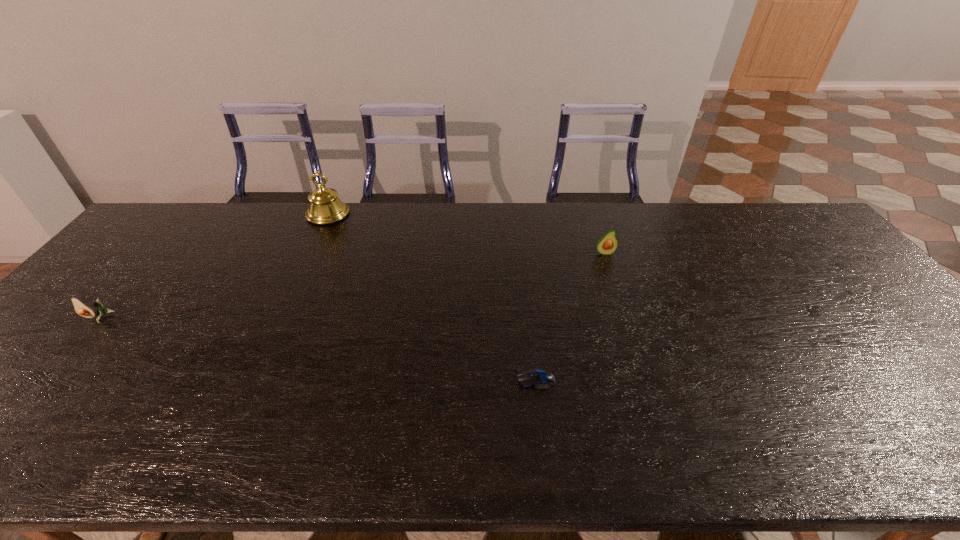
Locate an element on the screen. The image size is (960, 540). free area in between the right avocado and the third object from right to left is located at coordinates (467, 233).

At what (x,y) coordinates should I click in order to perform the action: click on blank region between the farther avocado and the shortest object. Please return your answer as a coordinate pair (x, y). The width and height of the screenshot is (960, 540). Looking at the image, I should click on (570, 316).

This screenshot has width=960, height=540. I want to click on free space that is in between the right avocado and the third object from left to right, so click(570, 316).

Locate an element on the screen. The height and width of the screenshot is (540, 960). unoccupied area between the farther avocado and the shortest object is located at coordinates (570, 316).

Image resolution: width=960 pixels, height=540 pixels. I want to click on vacant area between the rightmost object and the nearest object, so click(x=570, y=316).

Identify the location of vacant point located between the second object from left to right and the rightmost object. (467, 233).

Find the location of a particular element. The height and width of the screenshot is (540, 960). vacant area that lies between the left avocado and the rightmost object is located at coordinates (351, 285).

The height and width of the screenshot is (540, 960). I want to click on empty space that is in between the farther avocado and the nearest object, so click(x=570, y=316).

Image resolution: width=960 pixels, height=540 pixels. I want to click on free spot between the rightmost object and the tallest object, so click(x=467, y=233).

Where is `vacant space that is in between the nearest object and the tallest object`? vacant space that is in between the nearest object and the tallest object is located at coordinates (432, 296).